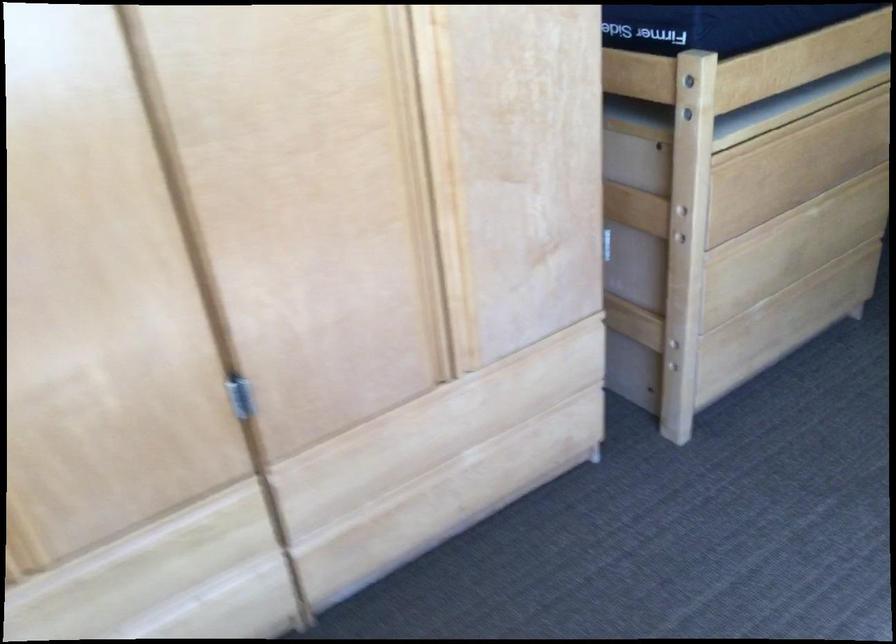
I want to click on black mattress, so click(x=718, y=24).